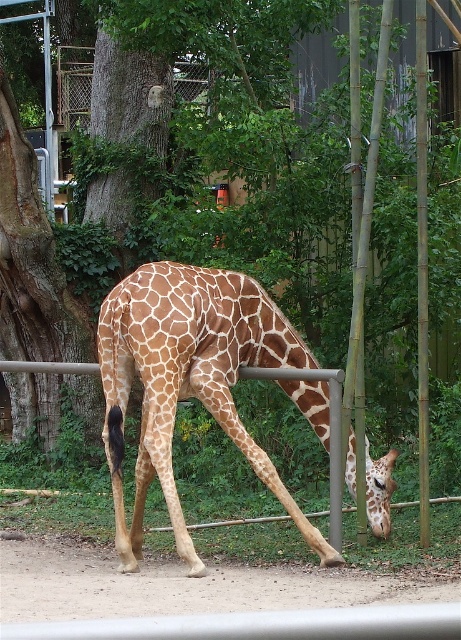
Question: Does brown spotted giraffe at center have a smaller size compared to brown textured tree at center?

Choices:
 (A) yes
 (B) no

Answer: (A)

Question: Is brown spotted giraffe at center positioned before brown textured giraffe head at center?

Choices:
 (A) no
 (B) yes

Answer: (B)

Question: Which object is the closest to the brown textured tree at center?

Choices:
 (A) brown spotted giraffe at center
 (B) brown textured giraffe head at center

Answer: (A)

Question: Which point appears closest to the camera in this image?

Choices:
 (A) (222, 72)
 (B) (366, 465)

Answer: (B)

Question: Does brown textured tree at center appear under brown textured giraffe head at center?

Choices:
 (A) no
 (B) yes

Answer: (A)

Question: Estimate the real-world distances between objects in this image. Which object is farther from the brown textured giraffe head at center?

Choices:
 (A) brown spotted giraffe at center
 (B) brown textured tree at center

Answer: (B)